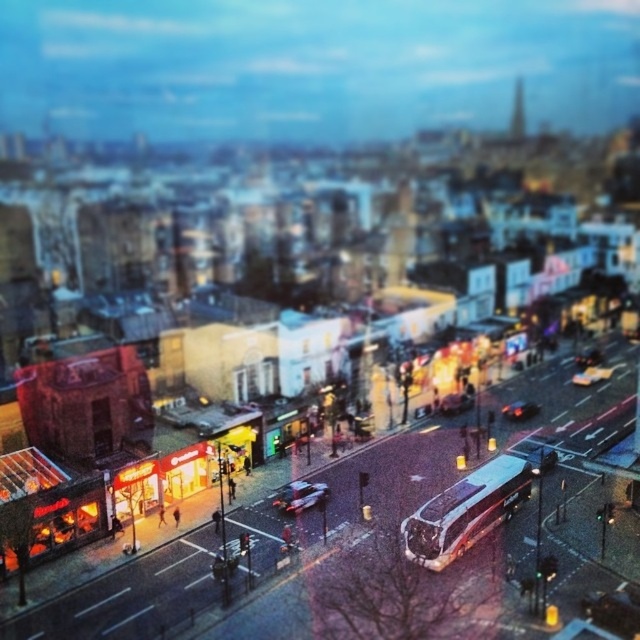
Question: Which point is closer to the camera?

Choices:
 (A) metallic silver car at center
 (B) shiny black car at center

Answer: (A)

Question: Is metallic silver car at center behind shiny black car at center?

Choices:
 (A) yes
 (B) no

Answer: (B)

Question: Is metallic silver car at center smaller than shiny black car at center?

Choices:
 (A) no
 (B) yes

Answer: (A)

Question: Which of the following is the closest to the observer?

Choices:
 (A) (317, 499)
 (B) (525, 417)

Answer: (A)

Question: In this image, where is metallic silver car at center located relative to shiny black car at center?

Choices:
 (A) below
 (B) above

Answer: (A)